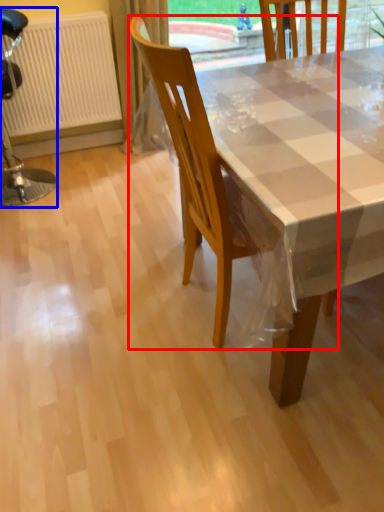
Question: Which of the following is the closest to the observer, chair (highlighted by a red box) or chair (highlighted by a blue box)?

Choices:
 (A) chair
 (B) chair

Answer: (A)